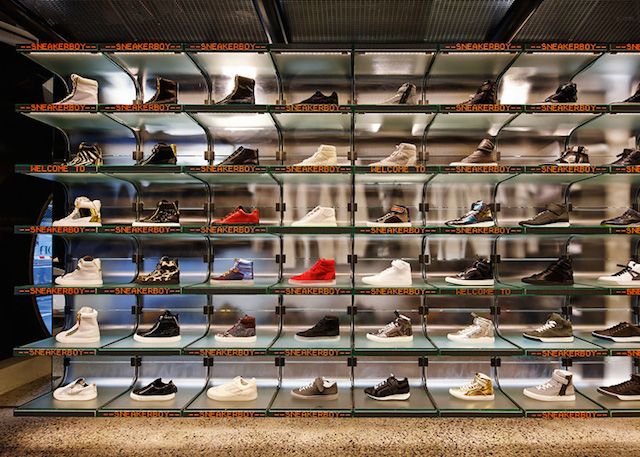
This screenshot has width=640, height=457. Identify the location of sneakers on 5th shelve. (79, 154), (166, 157), (241, 158), (324, 154), (394, 158), (484, 155), (569, 155), (632, 154).